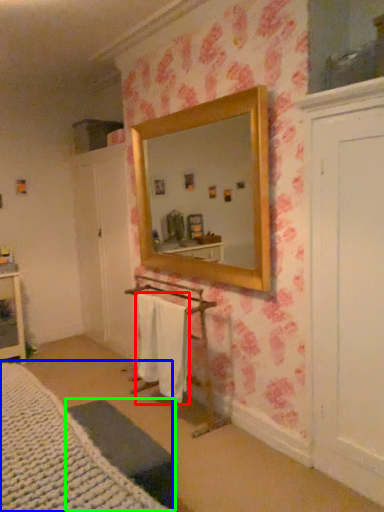
Question: Which object is the farthest from bath towel (highlighted by a red box)? Choose among these: bed (highlighted by a blue box) or furniture (highlighted by a green box).

Choices:
 (A) bed
 (B) furniture

Answer: (A)